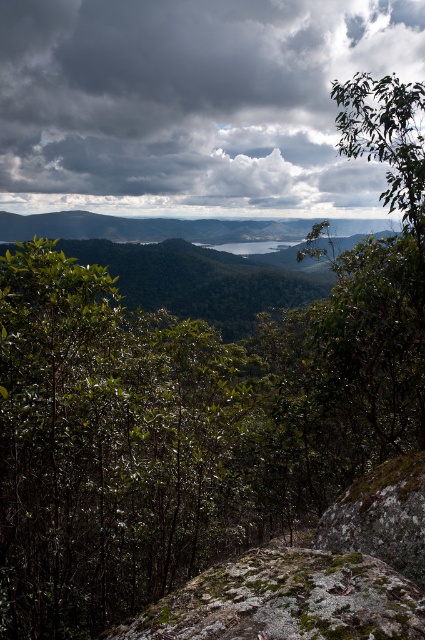
You are an artist planning to paint this landscape. You want to emphasize the contrast between the dark gray cloud at upper center and the mossy rock at center. Which object should you make larger in your painting to highlight this contrast?

To emphasize the contrast between the dark gray cloud at upper center and the mossy rock at center, you should make the dark gray cloud at upper center larger in your painting since it is already bigger than the mossy rock at center.

You are an artist planning to paint the scene. You want to ensure the dark gray cloud at upper center and the green mossy rock at lower right are proportionally accurate. Which object should you make wider in your painting?

The dark gray cloud at upper center should be made wider in the painting since its width surpasses that of the green mossy rock at lower right according to the description.

You are standing at the point marked as point (192,104) in the image. What object is located exactly at that point?

The dark gray cloud at upper center is located exactly at point (192,104).